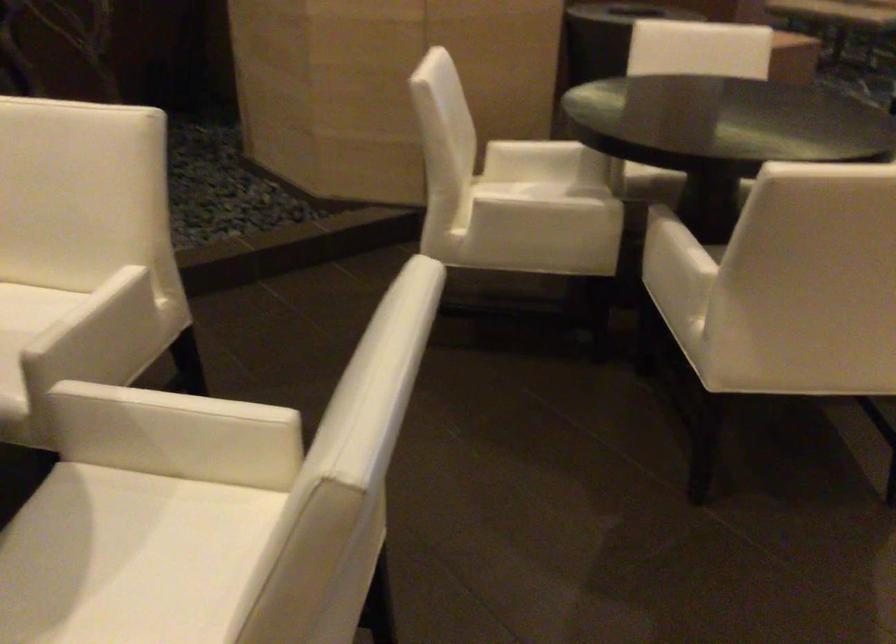
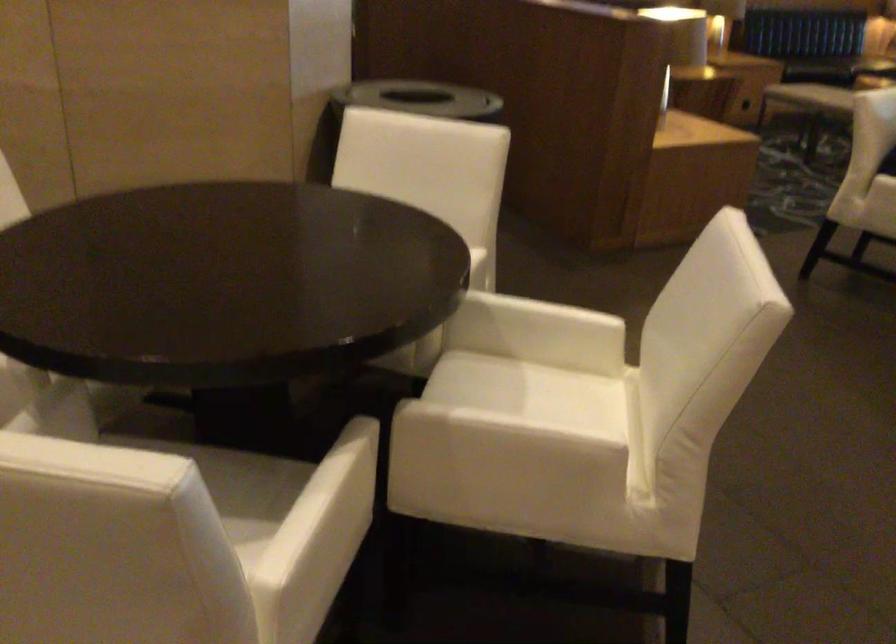
Question: I am providing you with two images of the same scene from different viewpoints. Which of the following objects are not visible in image2?

Choices:
 (A) white chair armrest
 (B) white chair sitting surface
 (C) chair sitting surface
 (D) leopard stuffed toy

Answer: (A)